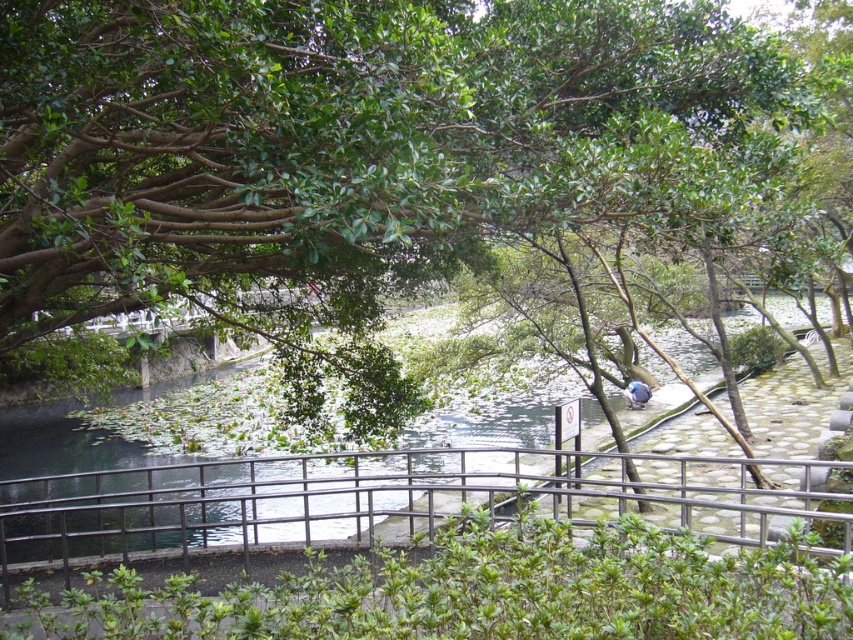
Is point (733, 160) behind point (540, 474)?

No, it is in front of (540, 474).

Does green leafy tree at upper center appear under metallic gray railing at center?

Incorrect, green leafy tree at upper center is not positioned below metallic gray railing at center.

Identify the location of green leafy tree at upper center. The width and height of the screenshot is (853, 640). (351, 145).